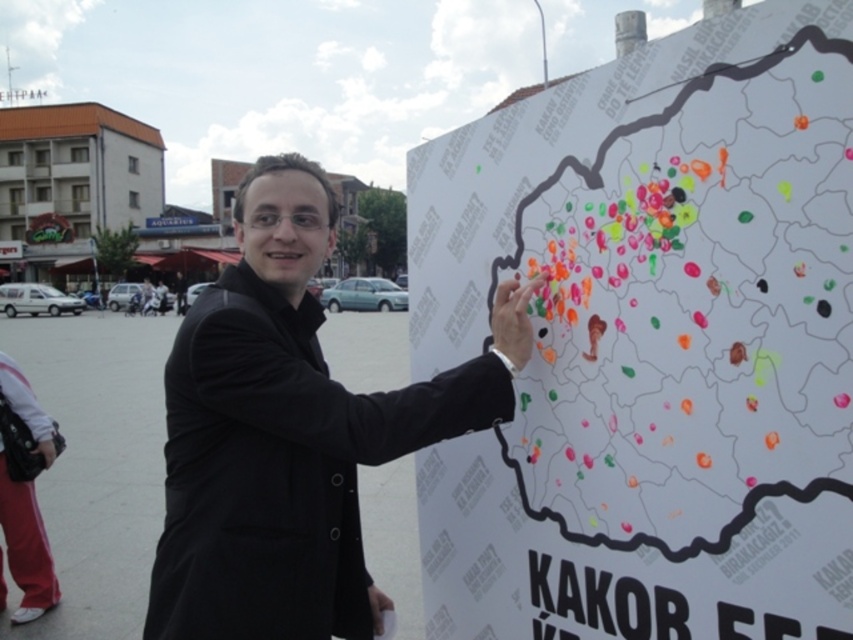
Question: Which object appears farthest from the camera in this image?

Choices:
 (A) white paper map at center
 (B) black matte coat at center

Answer: (B)

Question: Does white paper map at center appear on the left side of black matte coat at center?

Choices:
 (A) no
 (B) yes

Answer: (A)

Question: Which object appears farthest from the camera in this image?

Choices:
 (A) white paper map at center
 (B) black matte coat at center

Answer: (B)

Question: Does white paper map at center appear on the left side of black matte coat at center?

Choices:
 (A) yes
 (B) no

Answer: (B)

Question: Does white paper map at center have a smaller size compared to black matte coat at center?

Choices:
 (A) no
 (B) yes

Answer: (A)